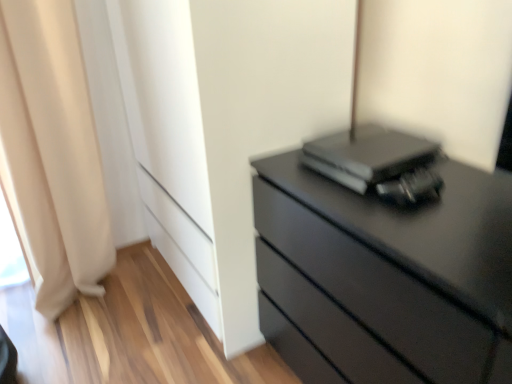
Locate an element on the screen. The width and height of the screenshot is (512, 384). free space in front of black matte computer at upper right is located at coordinates (402, 209).